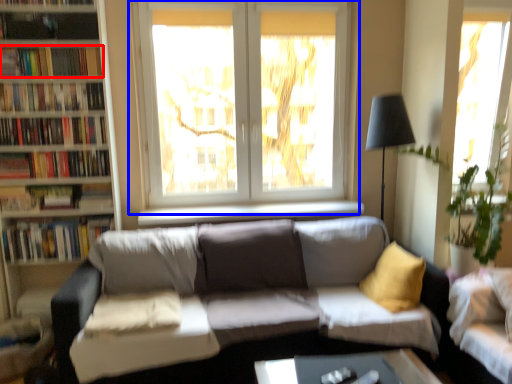
Question: Among these objects, which one is farthest to the camera, book (highlighted by a red box) or window (highlighted by a blue box)?

Choices:
 (A) book
 (B) window

Answer: (B)